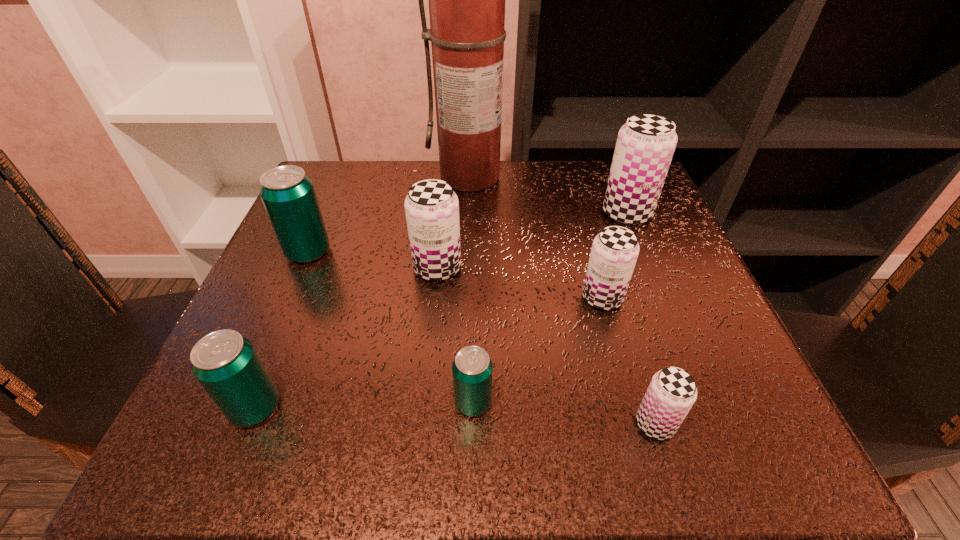
Locate an element on the screen. The image size is (960, 540). blank space located on the front-facing side of the fire extinguisher is located at coordinates (470, 231).

Locate an element on the screen. This screenshot has width=960, height=540. vacant space located 0.270m on the left of the biggest purple beer can is located at coordinates (473, 213).

Where is `vacant space situated 0.100m on the front of the biggest teal beer can`? The height and width of the screenshot is (540, 960). vacant space situated 0.100m on the front of the biggest teal beer can is located at coordinates (284, 308).

At what (x,y) coordinates should I click in order to perform the action: click on free location located on the front of the leftmost purple beer can. Please return your answer as a coordinate pair (x, y). Image resolution: width=960 pixels, height=540 pixels. Looking at the image, I should click on (425, 384).

Locate an element on the screen. The height and width of the screenshot is (540, 960). vacant area situated on the back of the second smallest purple beer can is located at coordinates (575, 197).

The width and height of the screenshot is (960, 540). I want to click on blank area located 0.060m on the right of the second smallest teal beer can, so click(324, 407).

Locate an element on the screen. The height and width of the screenshot is (540, 960). vacant space located on the left of the smallest purple beer can is located at coordinates (575, 424).

Find the location of a particular element. This screenshot has width=960, height=540. vacant space located 0.080m on the right of the rightmost teal beer can is located at coordinates (549, 402).

Where is `fire extinguisher located at the far edge`? fire extinguisher located at the far edge is located at coordinates (466, 0).

Locate an element on the screen. This screenshot has width=960, height=540. beer can present at the far edge is located at coordinates (645, 145).